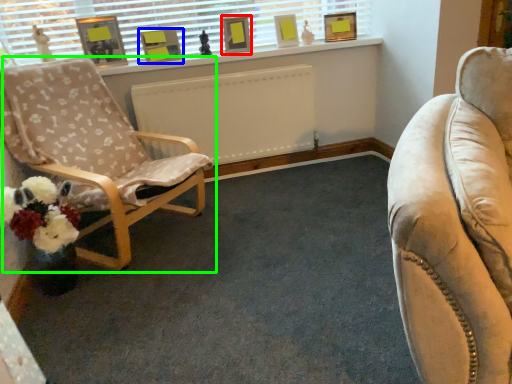
Question: Which is nearer to the picture frame (highlighted by a red box)? picture frame (highlighted by a blue box) or chair (highlighted by a green box).

Choices:
 (A) picture frame
 (B) chair

Answer: (A)